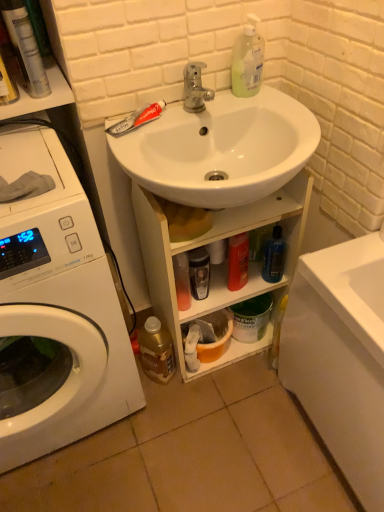
The width and height of the screenshot is (384, 512). Describe the element at coordinates (199, 272) in the screenshot. I see `shiny black bottle at center, which appears as the 1th toiletry when ordered from the bottom` at that location.

The image size is (384, 512). I want to click on blue translucent bottle at lower center, the first bottle positioned from the right, so click(x=274, y=256).

This screenshot has width=384, height=512. Find the location of `translucent plastic bottle at upper right`. translucent plastic bottle at upper right is located at coordinates (247, 60).

What do you see at coordinates (220, 264) in the screenshot? I see `white glossy cabinet at center` at bounding box center [220, 264].

This screenshot has width=384, height=512. What do you see at coordinates (220, 148) in the screenshot?
I see `white glossy sink at center` at bounding box center [220, 148].

What is the approximate width of white glossy sink at center?

It is 15.99 inches.

Where is `shiny black bottle at center, which appears as the 1th toiletry when ordered from the bottom`? Image resolution: width=384 pixels, height=512 pixels. shiny black bottle at center, which appears as the 1th toiletry when ordered from the bottom is located at coordinates (199, 272).

From a real-world perspective, which object stands above the other?

white glossy sink at center, from a real-world perspective.

Looking at this image, from the image's perspective, is white glossy sink at center on top of blue translucent bottle at lower center, which is the first bottle from top to bottom?

Yes, from the image's perspective, white glossy sink at center is above blue translucent bottle at lower center, which is the first bottle from top to bottom.

What are the coordinates of `bottle to the right of white glossy sink at center` in the screenshot? It's located at (274, 256).

In terms of height, does white glossy sink at center look taller or shorter compared to blue translucent bottle at lower center, marked as the 2th bottle in a bottom-to-top arrangement?

Clearly, white glossy sink at center is shorter compared to blue translucent bottle at lower center, marked as the 2th bottle in a bottom-to-top arrangement.

From the image's perspective, between blue translucent bottle at lower center, the 2th bottle from the left, and gold metallic bottle at lower left, the first bottle when ordered from bottom to top, who is located below?

gold metallic bottle at lower left, the first bottle when ordered from bottom to top.

Would you say blue translucent bottle at lower center, which is the first bottle from top to bottom, is inside or outside gold metallic bottle at lower left, the first bottle when ordered from bottom to top?

The correct answer is: outside.

In terms of width, does blue translucent bottle at lower center, the first bottle positioned from the right, look wider or thinner when compared to gold metallic bottle at lower left, which appears as the second bottle when viewed from the right?

blue translucent bottle at lower center, the first bottle positioned from the right, is thinner than gold metallic bottle at lower left, which appears as the second bottle when viewed from the right.

Measure the distance between blue translucent bottle at lower center, which is the first bottle from top to bottom, and gold metallic bottle at lower left, positioned as the 2th bottle in top-to-bottom order.

blue translucent bottle at lower center, which is the first bottle from top to bottom, and gold metallic bottle at lower left, positioned as the 2th bottle in top-to-bottom order, are 16.51 inches apart.

What's the angular difference between white glossy sink at center and white glossy cabinet at center's facing directions?

The angle between the facing direction of white glossy sink at center and the facing direction of white glossy cabinet at center is 1.9 degrees.

Considering the relative sizes of white glossy sink at center and white glossy cabinet at center in the image provided, is white glossy sink at center smaller than white glossy cabinet at center?

Indeed, white glossy sink at center has a smaller size compared to white glossy cabinet at center.

Does white glossy sink at center appear on the right side of white glossy cabinet at center?

No, white glossy sink at center is not to the right of white glossy cabinet at center.

Is white glossy sink at center looking in the opposite direction of white glossy cabinet at center?

No, white glossy sink at center is not facing the opposite direction of white glossy cabinet at center.

How distant is shiny black bottle at center, the 2th toiletry when ordered from back to front, from white glossy sink at center?

shiny black bottle at center, the 2th toiletry when ordered from back to front, is 12.95 inches from white glossy sink at center.

Which is more to the left, shiny black bottle at center, the 2th toiletry when ordered from front to back, or white glossy sink at center?

From the viewer's perspective, shiny black bottle at center, the 2th toiletry when ordered from front to back, appears more on the left side.

You are a GUI agent. You are given a task and a screenshot of the screen. Output one action in this format:
    pyautogui.click(x=<x>, y=<y>)
    Task: Click on the sink above the shiny black bottle at center, arranged as the 2th toiletry when viewed from the right (from a real-world perspective)
    The image size is (384, 512).
    Given the screenshot: What is the action you would take?
    click(220, 148)

Does white glossy washing machine at left have a lesser height compared to shiny orange bottle at lower center, the second toiletry ordered from the bottom?

No.

Consider the image. From a real-world perspective, is white glossy washing machine at left under shiny orange bottle at lower center, the second toiletry ordered from the bottom?

No.

Can you tell me how much white glossy washing machine at left and shiny orange bottle at lower center, arranged as the 1th toiletry when viewed from the back, differ in facing direction?

The angle between the facing direction of white glossy washing machine at left and the facing direction of shiny orange bottle at lower center, arranged as the 1th toiletry when viewed from the back, is 3.7 degrees.

From a real-world perspective, who is located lower, white glossy cabinet at center or white glossy sink at center?

In real-world perspective, white glossy cabinet at center is lower.

Which of these two, white glossy cabinet at center or white glossy sink at center, is thinner?

With smaller width is white glossy cabinet at center.

In terms of size, does white glossy cabinet at center appear bigger or smaller than white glossy sink at center?

In the image, white glossy cabinet at center appears to be larger than white glossy sink at center.

Is gold metallic bottle at lower left, positioned as the 2th bottle in top-to-bottom order, taller than blue translucent bottle at lower center, which is the first bottle from top to bottom?

Indeed, gold metallic bottle at lower left, positioned as the 2th bottle in top-to-bottom order, has a greater height compared to blue translucent bottle at lower center, which is the first bottle from top to bottom.

How many degrees apart are the facing directions of gold metallic bottle at lower left, positioned as the 2th bottle in top-to-bottom order, and blue translucent bottle at lower center, the 2th bottle from the left?

52.7 degrees separate the facing orientations of gold metallic bottle at lower left, positioned as the 2th bottle in top-to-bottom order, and blue translucent bottle at lower center, the 2th bottle from the left.

From a real-world perspective, who is located higher, gold metallic bottle at lower left, positioned as the 2th bottle in top-to-bottom order, or blue translucent bottle at lower center, the 2th bottle from the left?

blue translucent bottle at lower center, the 2th bottle from the left, from a real-world perspective.

Choose the correct answer: Is gold metallic bottle at lower left, which appears as the second bottle when viewed from the right, inside blue translucent bottle at lower center, which is the first bottle from top to bottom, or outside it?

gold metallic bottle at lower left, which appears as the second bottle when viewed from the right, is outside blue translucent bottle at lower center, which is the first bottle from top to bottom.

From the image's perspective, starting from the white glossy sink at center, which bottle is the 1st one below? Please provide its 2D coordinates.

[(274, 256)]

Find the location of a particular element. bottle that is behind the blue translucent bottle at lower center, the first bottle positioned from the right is located at coordinates (156, 350).

Which object lies further to the anchor point white glossy sink at center, shiny orange bottle at lower center, which ranks as the second toiletry in top-to-bottom order, or metallic silver spray can at upper left, the first toiletry when ordered from left to right?

metallic silver spray can at upper left, the first toiletry when ordered from left to right.

From the image, which object appears to be nearer to shiny black bottle at center, which is the third toiletry in top-to-bottom order, red matte toothpaste at upper left or white glossy washing machine at left?

red matte toothpaste at upper left.

Estimate the real-world distances between objects in this image. Which object is further from white glossy sink at center, blue translucent bottle at lower center, marked as the 2th bottle in a bottom-to-top arrangement, or metallic silver spray can at upper left, the first toiletry when ordered from left to right?

metallic silver spray can at upper left, the first toiletry when ordered from left to right, lies further to white glossy sink at center than the other object.

Considering their positions, is shiny orange bottle at lower center, which ranks as the second toiletry in top-to-bottom order, positioned closer to metallic silver spray can at upper left, the 3th toiletry positioned from the back, than gold metallic bottle at lower left, which ranks as the first bottle in left-to-right order?

Among the two, shiny orange bottle at lower center, which ranks as the second toiletry in top-to-bottom order, is located nearer to metallic silver spray can at upper left, the 3th toiletry positioned from the back.

Based on their spatial positions, is blue translucent bottle at lower center, marked as the 2th bottle in a bottom-to-top arrangement, or gold metallic bottle at lower left, which appears as the second bottle when viewed from the right, closer to metallic silver spray can at upper left, which appears as the third toiletry when viewed from the right?

blue translucent bottle at lower center, marked as the 2th bottle in a bottom-to-top arrangement, is positioned closer to the anchor metallic silver spray can at upper left, which appears as the third toiletry when viewed from the right.

From the picture: Estimate the real-world distances between objects in this image. Which object is further from metallic silver spray can at upper left, the first toiletry when ordered from left to right, translucent plastic bottle at upper right or red matte toothpaste at upper left?

translucent plastic bottle at upper right lies further to metallic silver spray can at upper left, the first toiletry when ordered from left to right, than the other object.

In the scene shown: Based on their spatial positions, is blue translucent bottle at lower center, the first bottle positioned from the right, or white glossy washing machine at left further from shiny orange bottle at lower center, the 3th toiletry when ordered from left to right?

The object further to shiny orange bottle at lower center, the 3th toiletry when ordered from left to right, is white glossy washing machine at left.

Estimate the real-world distances between objects in this image. Which object is closer to metallic silver spray can at upper left, the first toiletry positioned from the front, gold metallic bottle at lower left, which appears as the second bottle when viewed from the right, or white glossy cabinet at center?

Among the two, white glossy cabinet at center is located nearer to metallic silver spray can at upper left, the first toiletry positioned from the front.

I want to click on toothpaste between translucent plastic bottle at upper right and blue translucent bottle at lower center, the first bottle positioned from the right, in the vertical direction, so [137, 119].

Locate an element on the screen. The height and width of the screenshot is (512, 384). bathroom cabinet located between metallic silver spray can at upper left, arranged as the 1th toiletry when viewed from the top, and blue translucent bottle at lower center, the first bottle positioned from the right, in the left-right direction is located at coordinates (220, 264).

You are a GUI agent. You are given a task and a screenshot of the screen. Output one action in this format:
    pyautogui.click(x=<x>, y=<y>)
    Task: Click on the bathroom cabinet between white glossy sink at center and shiny black bottle at center, which appears as the 1th toiletry when ordered from the bottom, from front to back
    This screenshot has height=512, width=384.
    Given the screenshot: What is the action you would take?
    pyautogui.click(x=220, y=264)

What are the coordinates of `sink between metallic silver spray can at upper left, arranged as the 1th toiletry when viewed from the top, and gold metallic bottle at lower left, positioned as the 2th bottle in top-to-bottom order, vertically` in the screenshot? It's located at (220, 148).